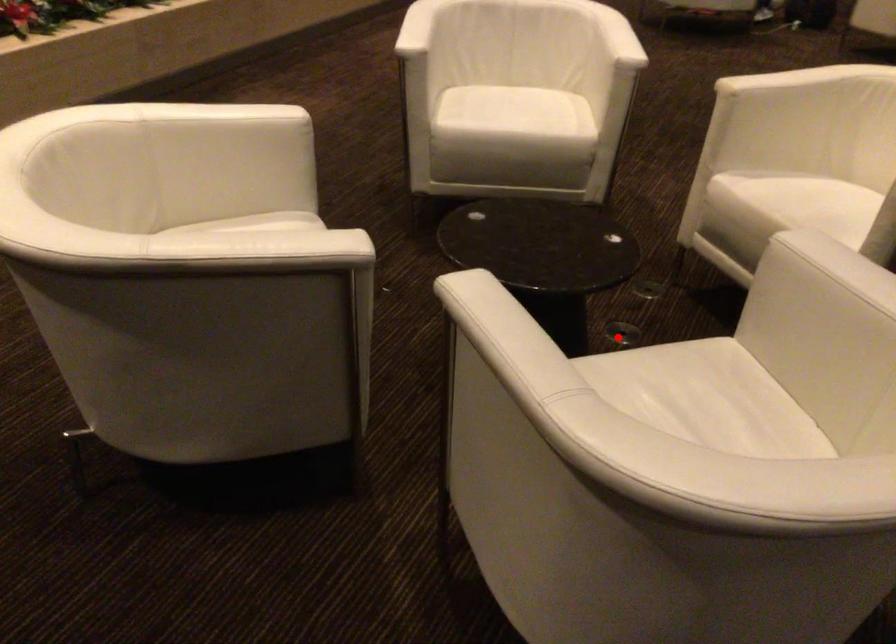
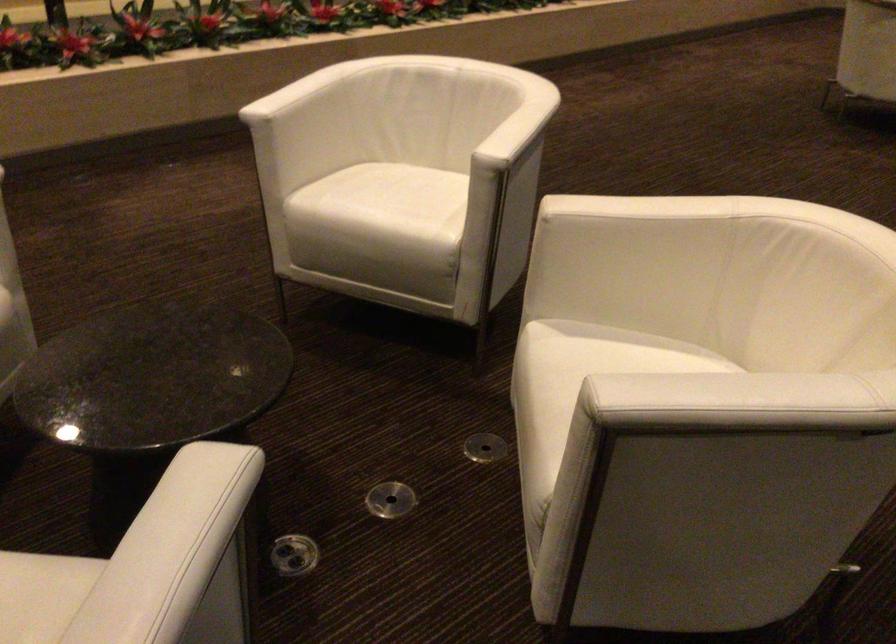
Find the pixel in the second image that matches the highlighted location in the first image.

(391, 500)